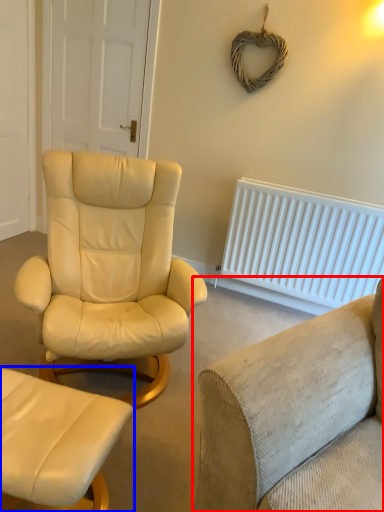
Question: Which object is closer to the camera taking this photo, studio couch (highlighted by a red box) or chair (highlighted by a blue box)?

Choices:
 (A) studio couch
 (B) chair

Answer: (A)